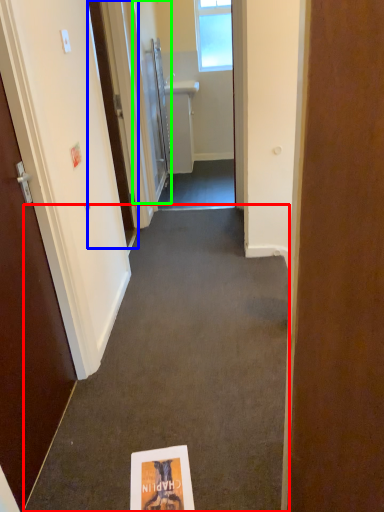
Question: Estimate the real-world distances between objects in this image. Which object is farther from path (highlighted by a red box), door (highlighted by a blue box) or door (highlighted by a green box)?

Choices:
 (A) door
 (B) door

Answer: (B)